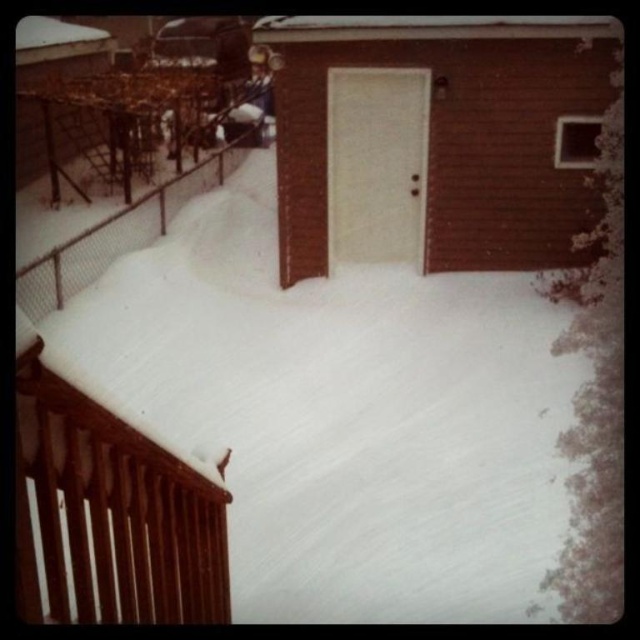
You are standing at the entrance of the red brick building and want to walk towards the brown wooden balustrade at lower left. Which direction should you turn to avoid the wire mesh fence at left?

You should turn to the right to head towards the brown wooden balustrade at lower left since it is located to the right of the wire mesh fence at left.

You are a delivery person trying to reach the front door of the building. You are currently standing on the white fluffy snow at lower center. The wire mesh fence at left is blocking your path. Can you step over the fence without moving more than 4 meters forward?

The distance between the white fluffy snow at lower center and the wire mesh fence at left is 4.52 meters. Since you can only move 4 meters forward, you cannot step over the fence as the distance is greater than your available movement range.